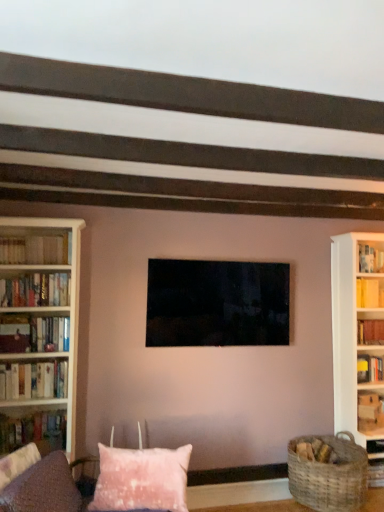
Identify the location of free spot above hardcover books at left, the 6th book in the bottom-to-top sequence (from a real-world perspective). The width and height of the screenshot is (384, 512). (33, 232).